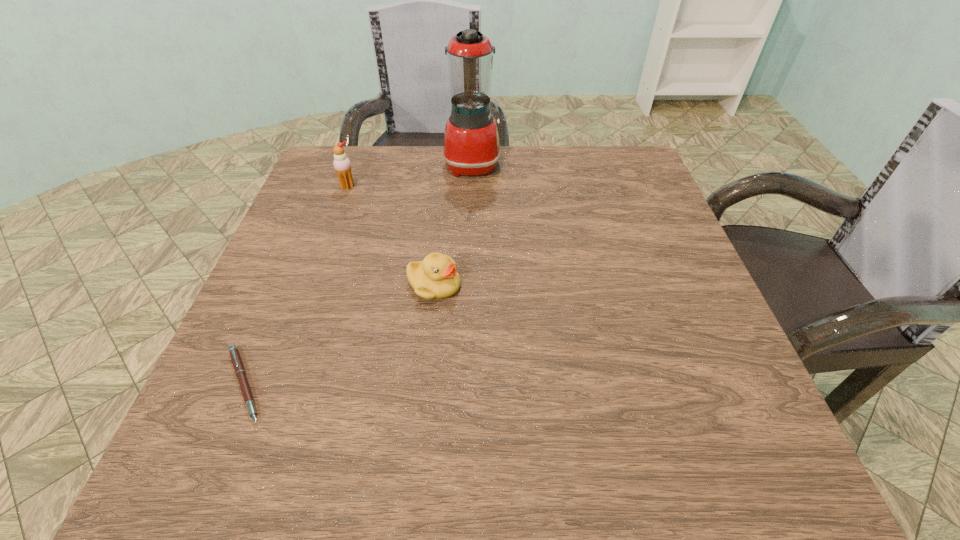
Find the location of a particular element. The width and height of the screenshot is (960, 540). the tallest object is located at coordinates (471, 142).

In order to click on the farthest object in this screenshot , I will do `click(471, 142)`.

Image resolution: width=960 pixels, height=540 pixels. I want to click on the third shortest object, so [342, 165].

Identify the location of icecream. (342, 165).

Image resolution: width=960 pixels, height=540 pixels. Identify the location of the second shortest object. (436, 277).

Locate an element on the screen. The image size is (960, 540). duckling is located at coordinates (436, 277).

Where is `pen`? pen is located at coordinates (237, 363).

What are the coordinates of `the shortest object` in the screenshot? It's located at (237, 363).

You are a GUI agent. You are given a task and a screenshot of the screen. Output one action in this format:
    pyautogui.click(x=<x>, y=<y>)
    Task: Click on the blank area located on the controls of the food processor
    
    Given the screenshot: What is the action you would take?
    pyautogui.click(x=599, y=164)

Where is `vacant space situated 0.050m at the front with a straw on the second farthest object`? This screenshot has width=960, height=540. vacant space situated 0.050m at the front with a straw on the second farthest object is located at coordinates (342, 204).